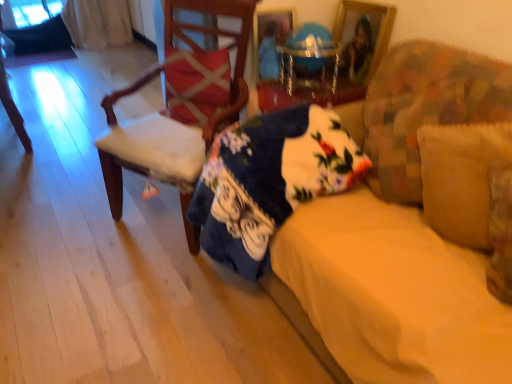
The height and width of the screenshot is (384, 512). What do you see at coordinates (172, 119) in the screenshot?
I see `wooden chair at left, placed as the first chair when sorted from right to left` at bounding box center [172, 119].

Measure the distance between wooden picture frame at upper center and camera.

They are 1.91 meters apart.

Describe the element at coordinates (12, 108) in the screenshot. I see `matte white chair at left, the first chair when ordered from back to front` at that location.

Describe the element at coordinates (303, 56) in the screenshot. The height and width of the screenshot is (384, 512). I see `metallic blue globe at center` at that location.

The width and height of the screenshot is (512, 384). I want to click on red textured pillow at center, placed as the 2th pillow when sorted from front to back, so click(x=196, y=84).

Is matte white chair at left, which is counted as the 1th chair, starting from the left, touching wooden chair at left, which appears as the 1th chair when viewed from the front?

matte white chair at left, which is counted as the 1th chair, starting from the left, and wooden chair at left, which appears as the 1th chair when viewed from the front, are not in contact.

How different are the orientations of matte white chair at left, placed as the 2th chair when sorted from front to back, and wooden chair at left, placed as the first chair when sorted from right to left, in degrees?

The angular difference between matte white chair at left, placed as the 2th chair when sorted from front to back, and wooden chair at left, placed as the first chair when sorted from right to left, is 24.3 degrees.

From a real-world perspective, between matte white chair at left, which is counted as the 1th chair, starting from the left, and wooden chair at left, which appears as the 1th chair when viewed from the front, who is vertically lower?

matte white chair at left, which is counted as the 1th chair, starting from the left, from a real-world perspective.

Considering the relative sizes of matte white chair at left, which is counted as the 1th chair, starting from the left, and wooden chair at left, placed as the first chair when sorted from right to left, in the image provided, is matte white chair at left, which is counted as the 1th chair, starting from the left, smaller than wooden chair at left, placed as the first chair when sorted from right to left,?

Indeed, matte white chair at left, which is counted as the 1th chair, starting from the left, has a smaller size compared to wooden chair at left, placed as the first chair when sorted from right to left.

Would you say wooden chair at left, which is the second chair from back to front, is outside suede-like beige pillow at right, positioned as the 1th pillow in right-to-left order?

Yes, wooden chair at left, which is the second chair from back to front, is outside of suede-like beige pillow at right, positioned as the 1th pillow in right-to-left order.

Which object is thinner, wooden chair at left, which is the second chair from back to front, or suede-like beige pillow at right, arranged as the first pillow when viewed from the front?

suede-like beige pillow at right, arranged as the first pillow when viewed from the front, is thinner.

Is point (218, 126) positioned in front of point (457, 167)?

That is False.

Between matte white chair at left, the first chair when ordered from back to front, and suede-like beige pillow at right, the 2th pillow from the top, which one has larger width?

matte white chair at left, the first chair when ordered from back to front, is wider.

Can you tell me how much matte white chair at left, placed as the 2th chair when sorted from front to back, and suede-like beige pillow at right, the 2th pillow in the back-to-front sequence, differ in facing direction?

The facing directions of matte white chair at left, placed as the 2th chair when sorted from front to back, and suede-like beige pillow at right, the 2th pillow in the back-to-front sequence, are 22.2 degrees apart.

Consider the image. In terms of size, does matte white chair at left, the first chair when ordered from back to front, appear bigger or smaller than suede-like beige pillow at right, positioned as the 1th pillow in right-to-left order?

Considering their sizes, matte white chair at left, the first chair when ordered from back to front, takes up more space than suede-like beige pillow at right, positioned as the 1th pillow in right-to-left order.

Considering the sizes of objects wooden picture frame at upper center and matte white chair at left, which is counted as the 1th chair, starting from the left, in the image provided, who is taller, wooden picture frame at upper center or matte white chair at left, which is counted as the 1th chair, starting from the left,?

With more height is matte white chair at left, which is counted as the 1th chair, starting from the left.

Considering the relative positions of wooden picture frame at upper center and matte white chair at left, which is counted as the 1th chair, starting from the left, in the image provided, is wooden picture frame at upper center to the left of matte white chair at left, which is counted as the 1th chair, starting from the left, from the viewer's perspective?

Incorrect, wooden picture frame at upper center is not on the left side of matte white chair at left, which is counted as the 1th chair, starting from the left.

Where is `picture frame on the right of the matte white chair at left, placed as the 2th chair when sorted from front to back`? picture frame on the right of the matte white chair at left, placed as the 2th chair when sorted from front to back is located at coordinates (370, 28).

Can you confirm if suede-like beige pillow at right, positioned as the 1th pillow in right-to-left order, is shorter than floral cotton blanket at center?

Yes, suede-like beige pillow at right, positioned as the 1th pillow in right-to-left order, is shorter than floral cotton blanket at center.

From the picture: Considering the relative sizes of suede-like beige pillow at right, arranged as the first pillow when viewed from the front, and floral cotton blanket at center in the image provided, is suede-like beige pillow at right, arranged as the first pillow when viewed from the front, wider than floral cotton blanket at center?

Incorrect, the width of suede-like beige pillow at right, arranged as the first pillow when viewed from the front, does not surpass that of floral cotton blanket at center.

Considering the relative sizes of suede-like beige pillow at right, positioned as the 1th pillow in right-to-left order, and floral cotton blanket at center in the image provided, is suede-like beige pillow at right, positioned as the 1th pillow in right-to-left order, bigger than floral cotton blanket at center?

Actually, suede-like beige pillow at right, positioned as the 1th pillow in right-to-left order, might be smaller than floral cotton blanket at center.

Is metallic blue globe at center positioned in front of fluffy fabric couch at center?

That is False.

How many degrees apart are the facing directions of metallic blue globe at center and fluffy fabric couch at center?

The angle between the facing direction of metallic blue globe at center and the facing direction of fluffy fabric couch at center is 25.7 degrees.

Consider the image. Considering the positions of objects metallic blue globe at center and fluffy fabric couch at center in the image provided, who is more to the right, metallic blue globe at center or fluffy fabric couch at center?

fluffy fabric couch at center is more to the right.

Between red textured pillow at center, marked as the 1th pillow in a left-to-right arrangement, and floral cotton blanket at center, which one has more height?

Standing taller between the two is floral cotton blanket at center.

Which is less distant, (227, 66) or (302, 126)?

Point (227, 66).

Considering the positions of objects red textured pillow at center, placed as the 2th pillow when sorted from front to back, and floral cotton blanket at center in the image provided, who is more to the left, red textured pillow at center, placed as the 2th pillow when sorted from front to back, or floral cotton blanket at center?

Positioned to the left is red textured pillow at center, placed as the 2th pillow when sorted from front to back.

From the image's perspective, who appears lower, red textured pillow at center, which is counted as the 2th pillow, starting from the right, or floral cotton blanket at center?

floral cotton blanket at center.

Find the location of a particular element. This screenshot has width=512, height=384. chair that is on the right side of matte white chair at left, which is counted as the 1th chair, starting from the left is located at coordinates (172, 119).

Locate an element on the screen. pillow below the wooden chair at left, placed as the first chair when sorted from right to left (from the image's perspective) is located at coordinates (461, 178).

From the image, which object appears to be nearer to fluffy fabric couch at center, wooden picture frame at upper center or matte white chair at left, the first chair when ordered from back to front?

Among the two, wooden picture frame at upper center is located nearer to fluffy fabric couch at center.

When comparing their distances from wooden chair at left, which is the second chair from back to front, does fluffy fabric couch at center or suede-like beige pillow at right, acting as the first pillow starting from the bottom, seem closer?

fluffy fabric couch at center is positioned closer to the anchor wooden chair at left, which is the second chair from back to front.

From the picture: From the image, which object appears to be farther from matte white chair at left, which is counted as the second chair, starting from the right, metallic blue globe at center or suede-like beige pillow at right, the 2th pillow in the back-to-front sequence?

suede-like beige pillow at right, the 2th pillow in the back-to-front sequence, is further to matte white chair at left, which is counted as the second chair, starting from the right.

When comparing their distances from red textured pillow at center, placed as the 2th pillow when sorted from front to back, does fluffy fabric couch at center or matte white chair at left, the first chair when ordered from back to front, seem closer?

fluffy fabric couch at center is positioned closer to the anchor red textured pillow at center, placed as the 2th pillow when sorted from front to back.

From the image, which object appears to be nearer to metallic blue globe at center, wooden chair at left, which appears as the 1th chair when viewed from the front, or red textured pillow at center, which is counted as the 2th pillow, starting from the right?

red textured pillow at center, which is counted as the 2th pillow, starting from the right, lies closer to metallic blue globe at center than the other object.

Estimate the real-world distances between objects in this image. Which object is closer to fluffy fabric couch at center, wooden picture frame at upper center or wooden chair at left, which appears as the 1th chair when viewed from the front?

Among the two, wooden chair at left, which appears as the 1th chair when viewed from the front, is located nearer to fluffy fabric couch at center.

Considering their positions, is wooden chair at left, which appears as the second chair when viewed from the left, positioned closer to metallic blue globe at center than fluffy fabric couch at center?

The object closer to metallic blue globe at center is wooden chair at left, which appears as the second chair when viewed from the left.

From the image, which object appears to be farther from suede-like beige pillow at right, positioned as the 1th pillow in right-to-left order, red textured pillow at center, placed as the 2th pillow when sorted from front to back, or fluffy fabric couch at center?

red textured pillow at center, placed as the 2th pillow when sorted from front to back.

You are a GUI agent. You are given a task and a screenshot of the screen. Output one action in this format:
    pyautogui.click(x=<x>, y=<y>)
    Task: Click on the chair situated between matte white chair at left, which is counted as the 1th chair, starting from the left, and floral cotton blanket at center from left to right
    The width and height of the screenshot is (512, 384).
    Given the screenshot: What is the action you would take?
    pyautogui.click(x=172, y=119)

At what (x,y) coordinates should I click in order to perform the action: click on chair located between fluffy fabric couch at center and wooden picture frame at upper center in the depth direction. Please return your answer as a coordinate pair (x, y). This screenshot has height=384, width=512. Looking at the image, I should click on (172, 119).

This screenshot has width=512, height=384. In order to click on picture frame between wooden chair at left, placed as the first chair when sorted from right to left, and suede-like beige pillow at right, the 2th pillow from the top, in the horizontal direction in this screenshot , I will do `click(370, 28)`.

Image resolution: width=512 pixels, height=384 pixels. What are the coordinates of `blanket between fluffy fabric couch at center and wooden chair at left, which appears as the second chair when viewed from the left, from front to back` in the screenshot? It's located at (269, 181).